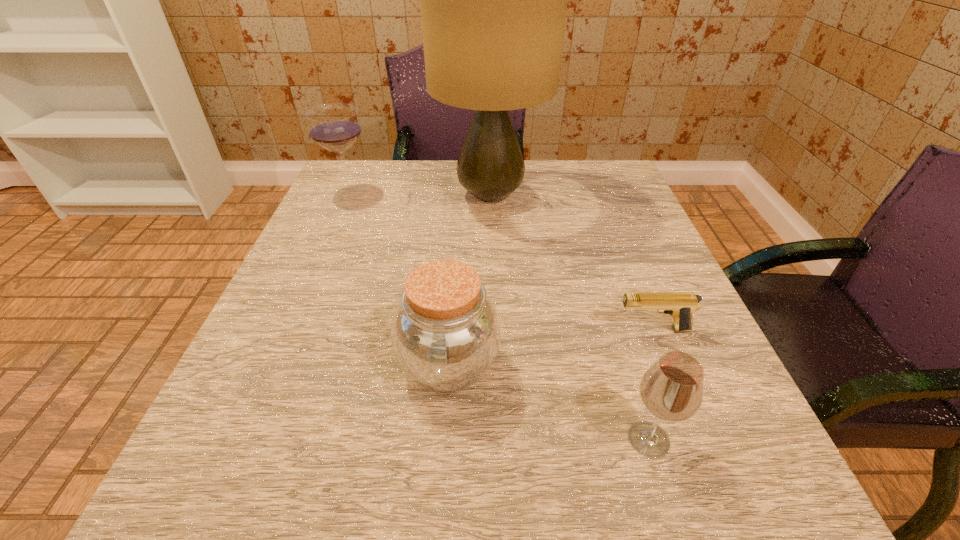
Identify the location of object located at the far left corner. This screenshot has height=540, width=960. (335, 127).

Image resolution: width=960 pixels, height=540 pixels. I want to click on object present at the near right corner, so click(x=672, y=389).

Locate an element on the screen. This screenshot has height=540, width=960. free space at the far edge is located at coordinates (543, 164).

Locate an element on the screen. This screenshot has height=540, width=960. vacant space at the near edge of the desktop is located at coordinates (552, 494).

In the image, there is a desktop. Where is `blank space at the left edge`? blank space at the left edge is located at coordinates (322, 316).

The image size is (960, 540). Find the location of `vacant area at the right edge`. vacant area at the right edge is located at coordinates (736, 402).

I want to click on vacant area at the far left corner, so click(x=382, y=208).

In the image, there is a desktop. At what (x,y) coordinates should I click in order to perform the action: click on vacant space at the near left corner. Please return your answer as a coordinate pair (x, y). Image resolution: width=960 pixels, height=540 pixels. Looking at the image, I should click on (199, 467).

Identify the location of vacant space at the far right corner. (609, 190).

Where is `empty space that is in between the farther wineglass and the pistol`? The image size is (960, 540). empty space that is in between the farther wineglass and the pistol is located at coordinates (501, 261).